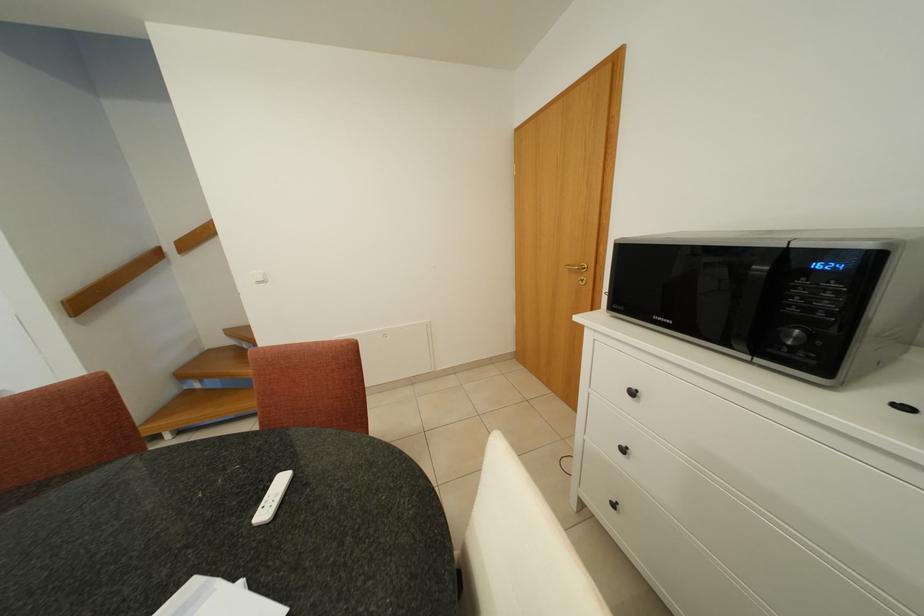
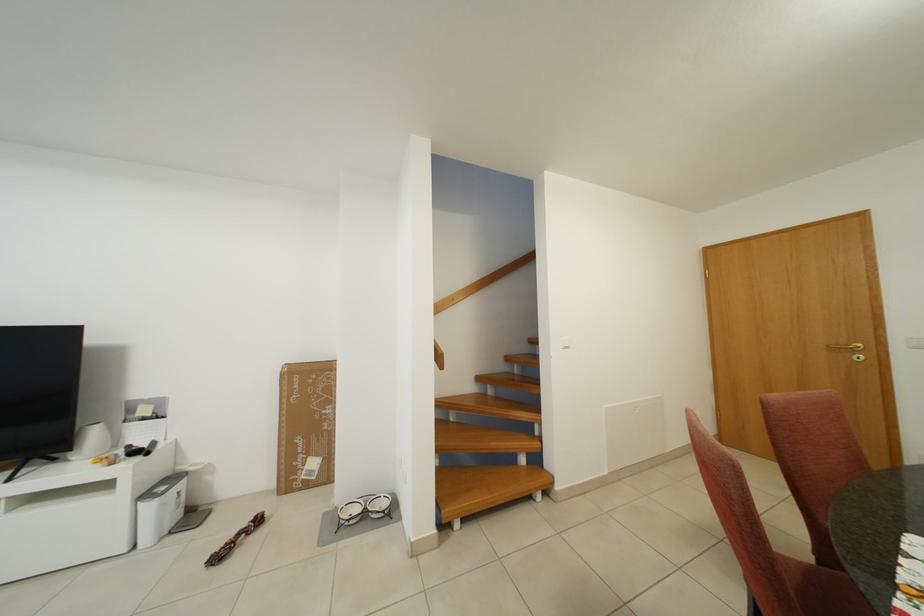
Question: In a continuous first-person perspective shot, in which direction is the camera moving?

Choices:
 (A) Left
 (B) Right
 (C) Forward
 (D) Backward

Answer: (A)